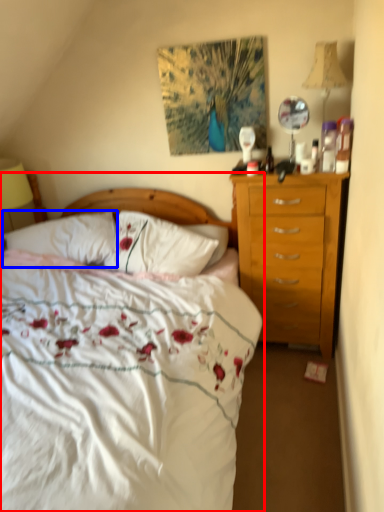
Question: Among these objects, which one is farthest to the camera, bed (highlighted by a red box) or pillow (highlighted by a blue box)?

Choices:
 (A) bed
 (B) pillow

Answer: (B)